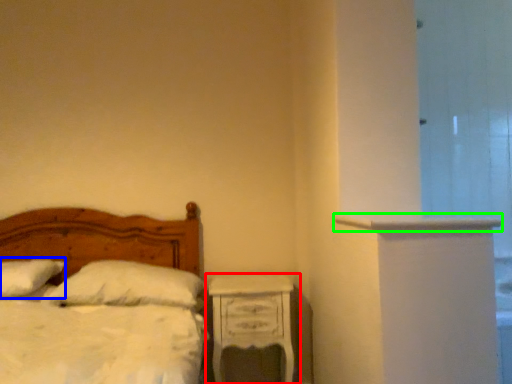
Question: Which is nearer to the nightstand (highlighted by a red box)? pillow (highlighted by a blue box) or ledge (highlighted by a green box).

Choices:
 (A) pillow
 (B) ledge

Answer: (B)